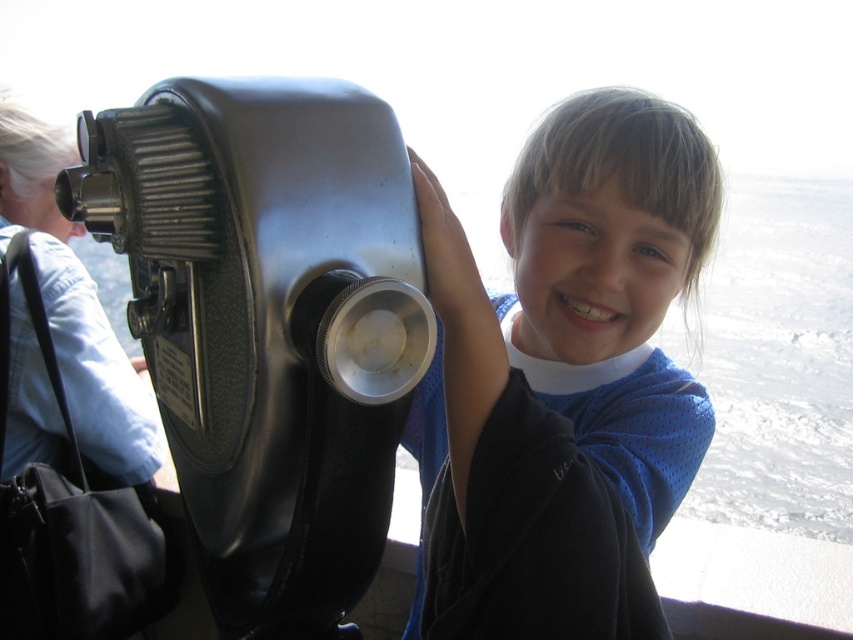
Question: Is metallic gray telescope at left bigger than blue mesh shirt at center?

Choices:
 (A) yes
 (B) no

Answer: (B)

Question: Which object appears closest to the camera in this image?

Choices:
 (A) blue mesh shirt at center
 (B) metallic gray telescope at left

Answer: (B)

Question: Does metallic gray telescope at left appear on the left side of blue mesh shirt at center?

Choices:
 (A) yes
 (B) no

Answer: (A)

Question: Is metallic gray telescope at left closer to camera compared to blue mesh shirt at center?

Choices:
 (A) no
 (B) yes

Answer: (B)

Question: Which object is farther from the camera taking this photo?

Choices:
 (A) metallic gray telescope at left
 (B) blue mesh shirt at center

Answer: (B)

Question: Which point is farther to the camera?

Choices:
 (A) blue mesh shirt at center
 (B) metallic gray telescope at left

Answer: (A)